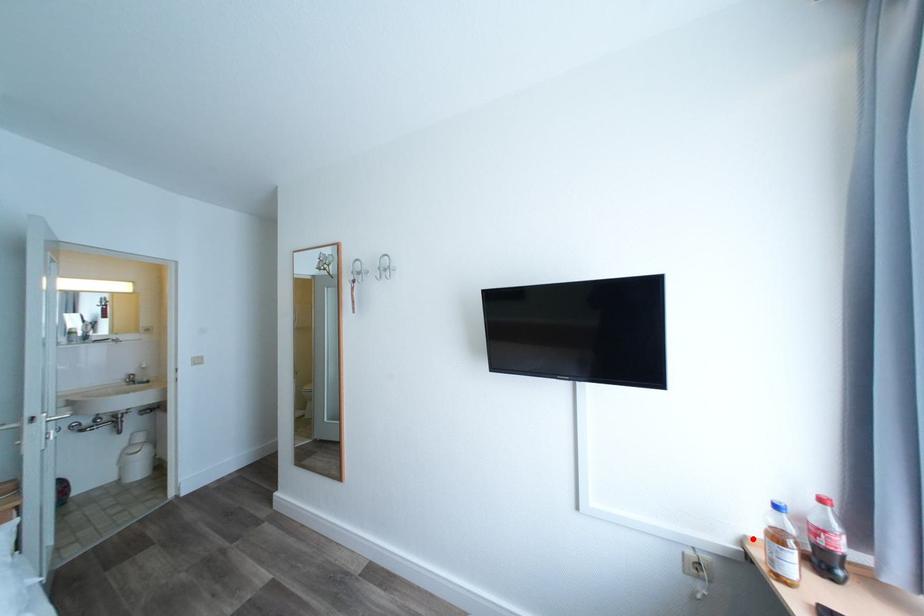
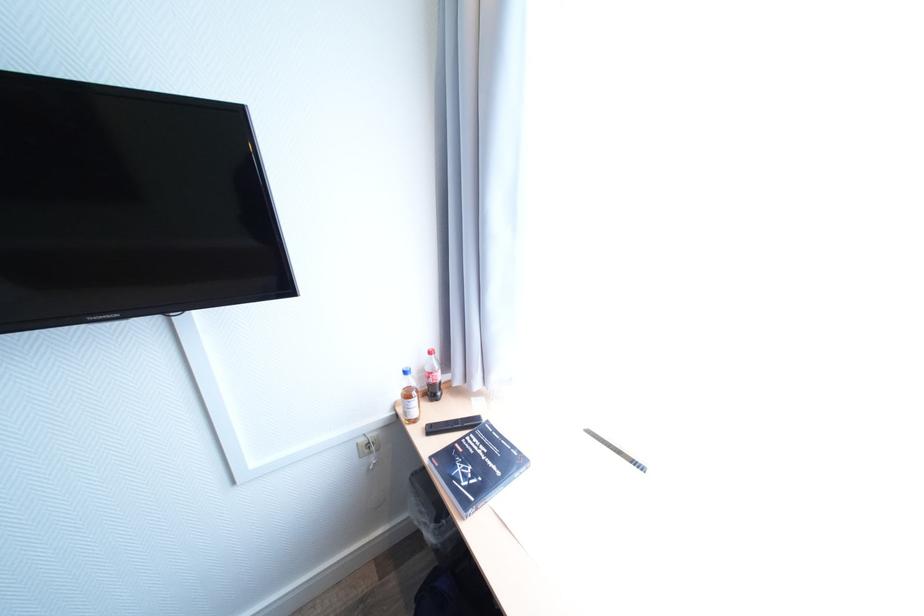
In the second image, find the point that corresponds to the highlighted location in the first image.

(403, 403)